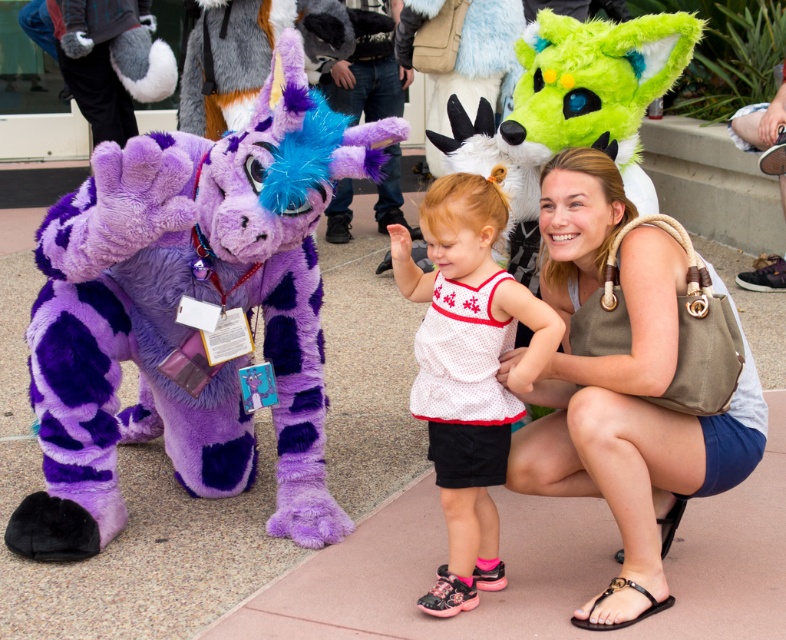
You are a photographer trying to capture a photo of the purple plush at left and the white mesh top at center. Based on their positions, which object should you focus on first if you want to ensure both are in the frame without moving the camera?

The purple plush at left is located above the white mesh top at center, so you should focus on the white mesh top at center first to ensure both are in the frame without moving the camera.